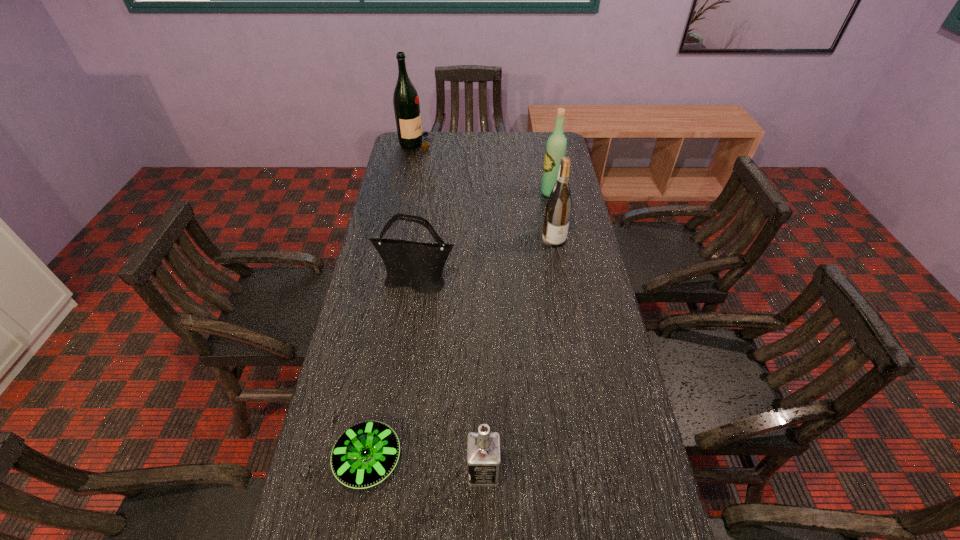
In order to click on vacant space situated 0.250m on the front-facing side of the second nearest wine bottle in this screenshot , I will do `click(477, 193)`.

The height and width of the screenshot is (540, 960). What are the coordinates of `free space located on the front-facing side of the second nearest wine bottle` in the screenshot? It's located at (480, 193).

Locate an element on the screen. This screenshot has height=540, width=960. free space located 0.210m on the front-facing side of the second nearest wine bottle is located at coordinates (488, 193).

This screenshot has height=540, width=960. I want to click on free space located 0.380m on the front of the fourth nearest object, so click(x=571, y=338).

You are a GUI agent. You are given a task and a screenshot of the screen. Output one action in this format:
    pyautogui.click(x=<x>, y=<y>)
    Task: Click on the free space located on the front of the third nearest object
    
    Given the screenshot: What is the action you would take?
    pyautogui.click(x=413, y=311)

This screenshot has width=960, height=540. Identify the location of vacant space located 0.180m on the front label of the fourth object from left to right. (389, 471).

Where is `vacant space situated on the front label of the fourth object from left to right`? Image resolution: width=960 pixels, height=540 pixels. vacant space situated on the front label of the fourth object from left to right is located at coordinates (322, 471).

Locate an element on the screen. Image resolution: width=960 pixels, height=540 pixels. free spot located on the front label of the fourth object from left to right is located at coordinates (442, 471).

At what (x,y) coordinates should I click in order to perform the action: click on free space located 0.210m on the back of the saucer. Please return your answer as a coordinate pair (x, y). The height and width of the screenshot is (540, 960). Looking at the image, I should click on (387, 355).

Locate an element on the screen. Image resolution: width=960 pixels, height=540 pixels. object present at the far edge is located at coordinates [x=405, y=99].